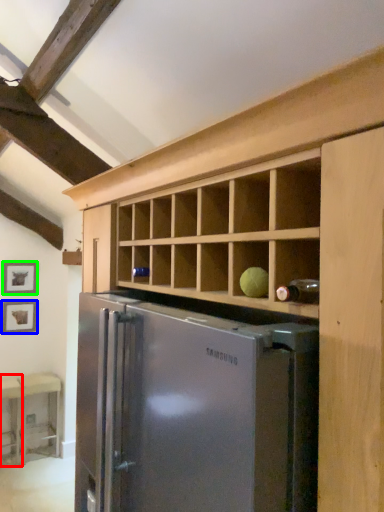
Question: Which object is positioned farthest from table (highlighted by a red box)? Select from picture frame (highlighted by a blue box) and picture frame (highlighted by a green box).

Choices:
 (A) picture frame
 (B) picture frame

Answer: (B)